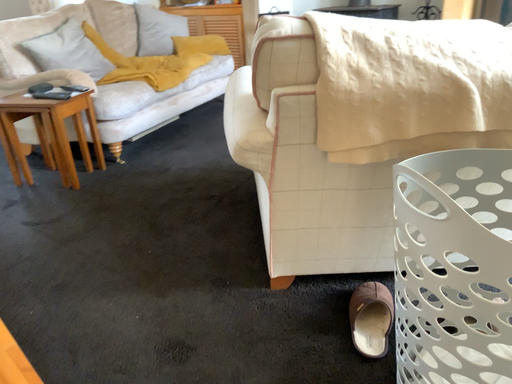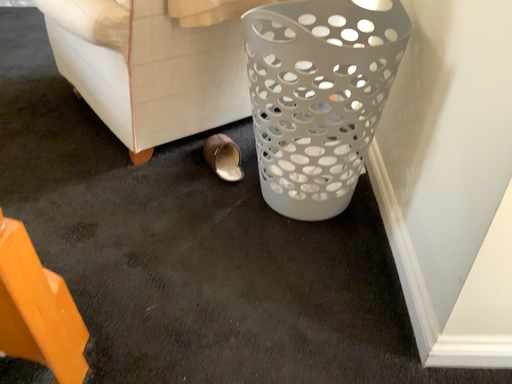
Question: How did the camera likely rotate when shooting the video?

Choices:
 (A) rotated right
 (B) rotated left

Answer: (A)